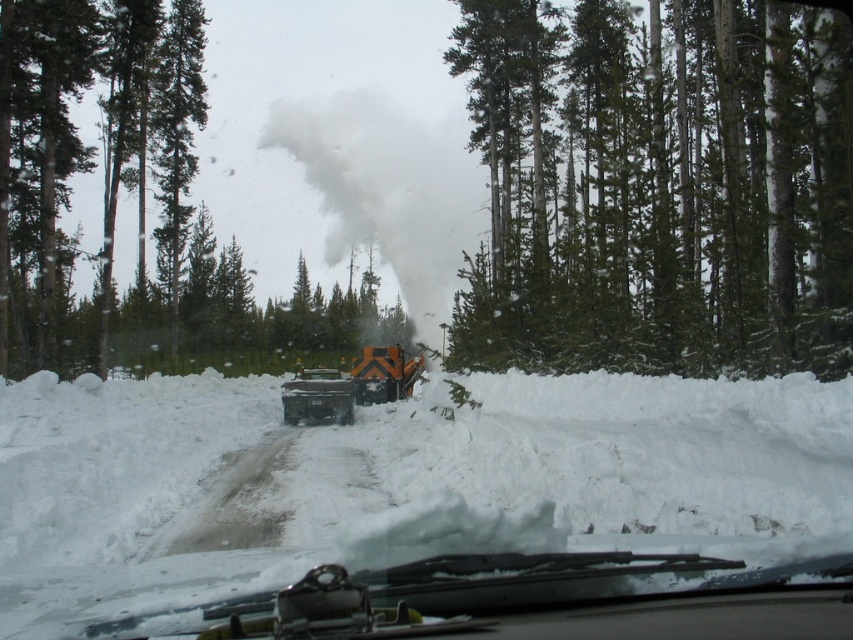
Is green textured tree at center bigger than orange metallic trailer truck at center?

Indeed, green textured tree at center has a larger size compared to orange metallic trailer truck at center.

Does green textured tree at center appear on the right side of orange metallic trailer truck at center?

Correct, you'll find green textured tree at center to the right of orange metallic trailer truck at center.

Identify the location of green textured tree at center. (659, 188).

Who is more distant from viewer, (390, 180) or (375, 378)?

Point (390, 180)

This screenshot has height=640, width=853. Describe the element at coordinates (387, 192) in the screenshot. I see `white powdery smoke at center` at that location.

Does point (350, 106) lie in front of point (375, 392)?

No, it is not.

Find the location of a particular element. This screenshot has width=853, height=640. white powdery smoke at center is located at coordinates (387, 192).

Is white fluffy snow at center to the right of orange metallic trailer truck at center from the viewer's perspective?

No, white fluffy snow at center is not to the right of orange metallic trailer truck at center.

Is white fluffy snow at center behind orange metallic trailer truck at center?

No, white fluffy snow at center is closer to the viewer.

At what (x,y) coordinates should I click in order to perform the action: click on white fluffy snow at center. Please return your answer as a coordinate pair (x, y). The image size is (853, 640). Looking at the image, I should click on (403, 481).